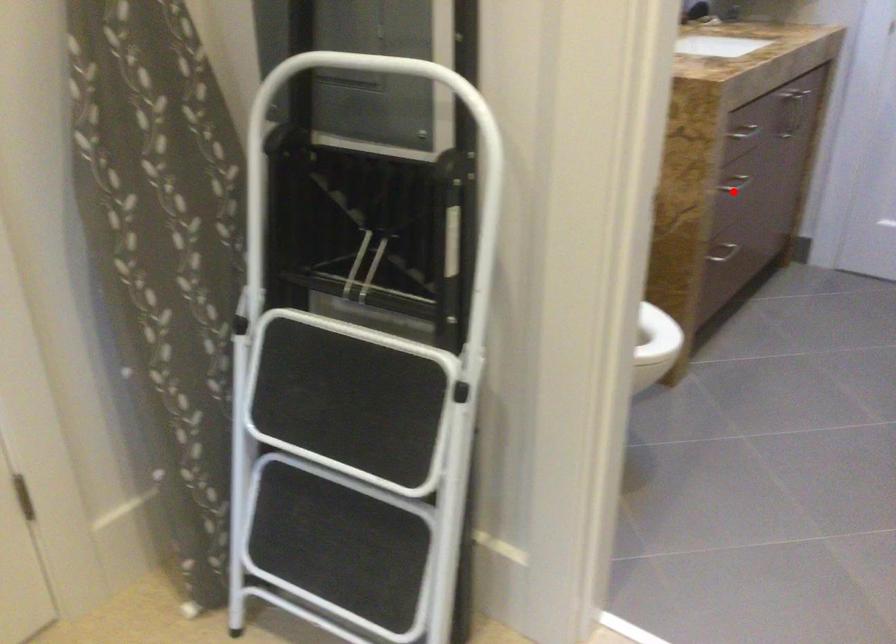
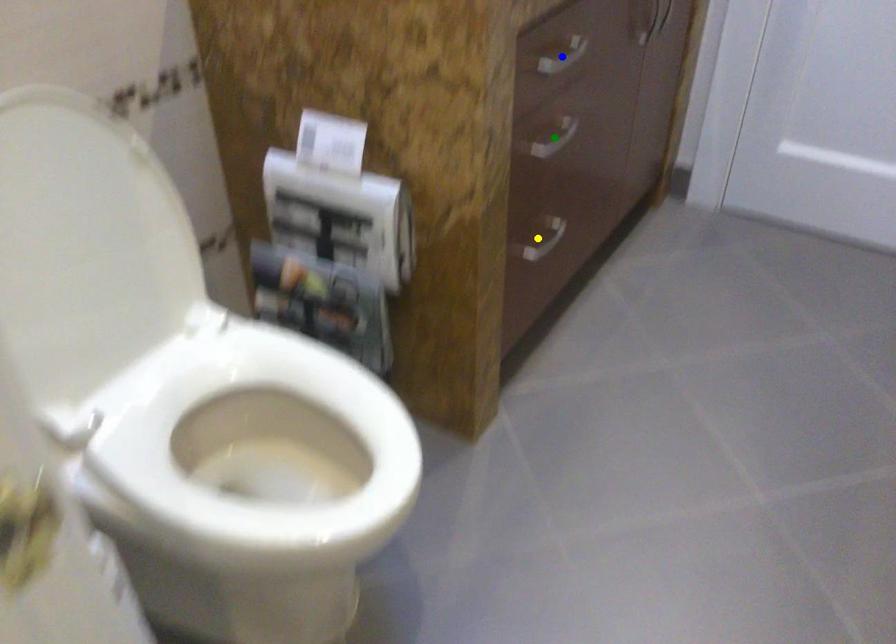
Question: I am providing you with two images of the same scene from different viewpoints. A red point is marked on the first image. You are given multiple points on the second image. Which point in image 2 represents the same 3d spot as the red point in image 1?

Choices:
 (A) blue point
 (B) yellow point
 (C) green point

Answer: (C)